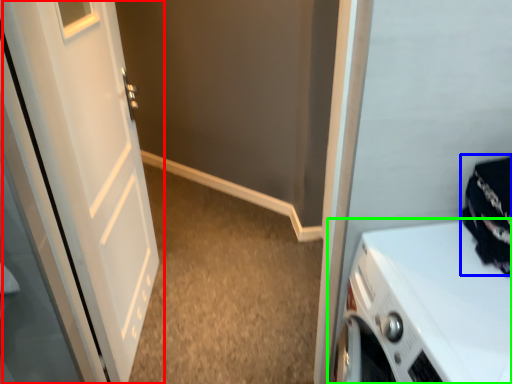
Question: Based on their relative distances, which object is nearer to door (highlighted by a red box)? Choose from clothing (highlighted by a blue box) and home appliance (highlighted by a green box).

Choices:
 (A) clothing
 (B) home appliance

Answer: (B)